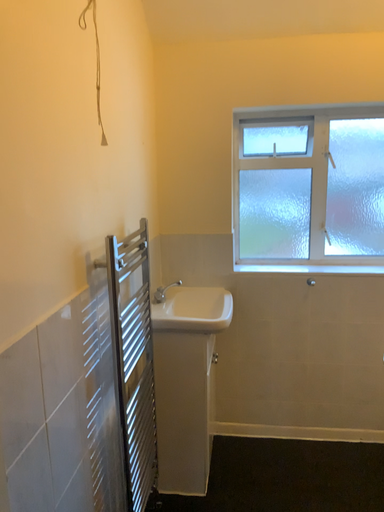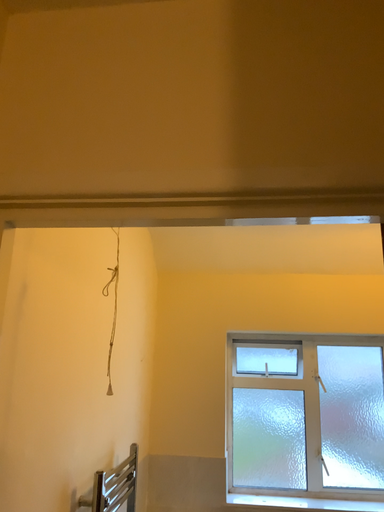
Question: How did the camera likely rotate when shooting the video?

Choices:
 (A) rotated downward
 (B) rotated upward

Answer: (B)